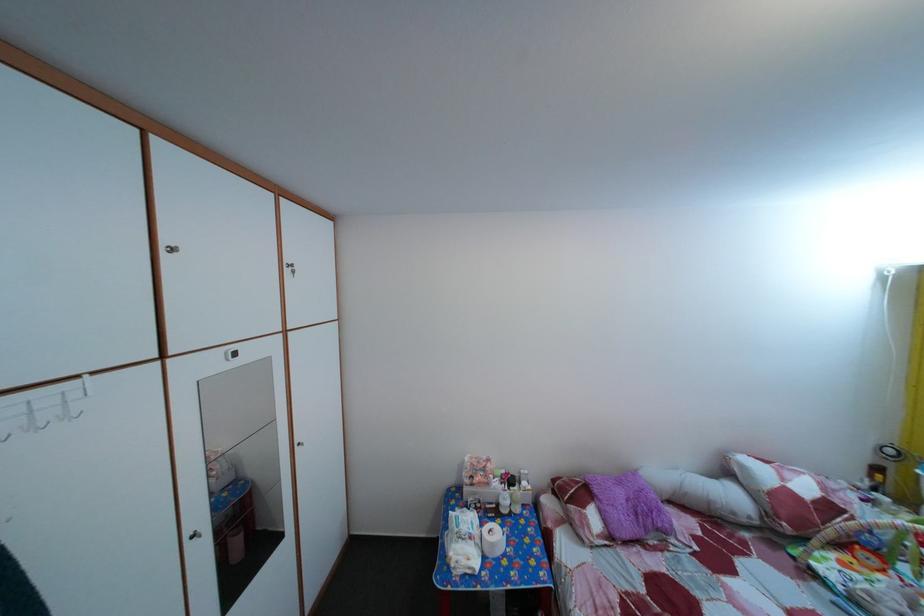
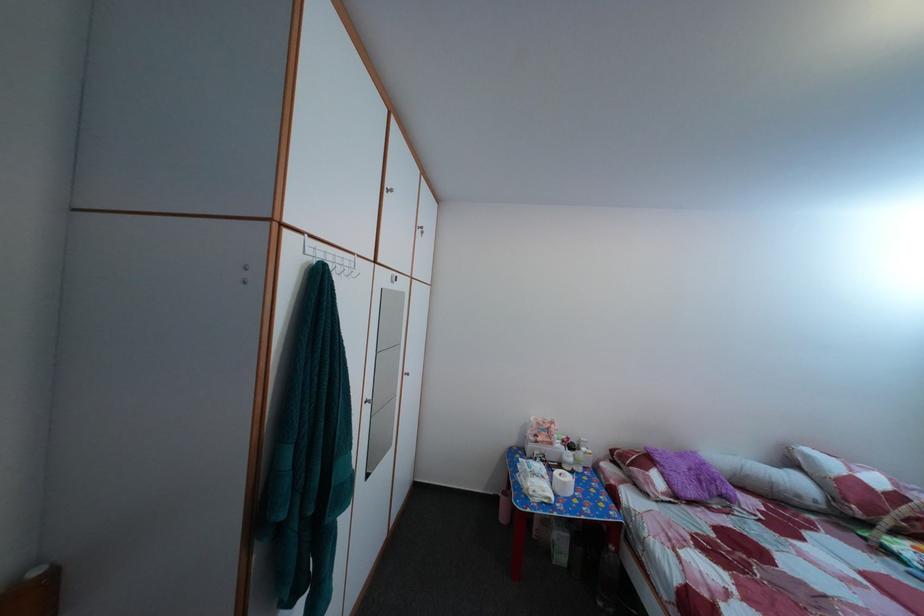
In a continuous first-person perspective shot, in which direction is the camera moving?

The movement direction of the cameraman is left, backward.